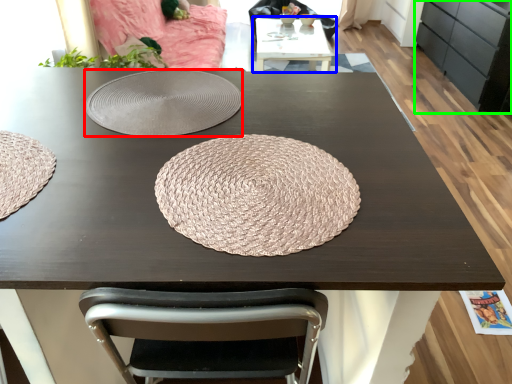
Question: Which is nearer to the plate (highlighted by a red box)? table (highlighted by a blue box) or cabinetry (highlighted by a green box).

Choices:
 (A) table
 (B) cabinetry

Answer: (A)